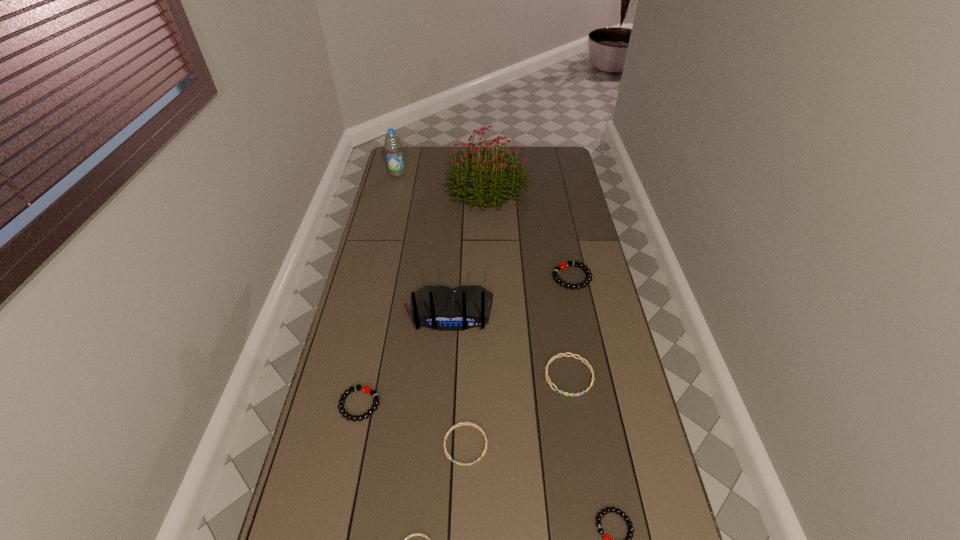
Where is `vacant space in between the fourth farthest object and the biggest black bracelet`? vacant space in between the fourth farthest object and the biggest black bracelet is located at coordinates (512, 295).

Locate an element on the screen. empty space between the third farthest object and the rightmost blue bracelet is located at coordinates (570, 326).

This screenshot has width=960, height=540. What are the coordinates of `vacant point located between the farthest black bracelet and the water bottle` in the screenshot? It's located at (x=485, y=226).

Select which object is the sixth closest to the blue water bottle. Please provide its 2D coordinates. Your answer should be formatted as a tuple, i.e. [(x, y)], where the tuple contains the x and y coordinates of a point satisfying the conditions above.

[(464, 423)]

Locate which object ranks fourth in proximity to the farthest blue bracelet. Please provide its 2D coordinates. Your answer should be formatted as a tuple, i.e. [(x, y)], where the tuple contains the x and y coordinates of a point satisfying the conditions above.

[(607, 538)]

Find the location of `the closest bracelet to the farthest bracelet`. the closest bracelet to the farthest bracelet is located at coordinates (550, 383).

Locate an element on the screen. The image size is (960, 540). the third closest bracelet to the leftmost bracelet is located at coordinates (550, 383).

You are a GUI agent. You are given a task and a screenshot of the screen. Output one action in this format:
    pyautogui.click(x=<x>, y=<y>)
    Task: Click on the closest black bracelet to the smallest black bracelet
    The image size is (960, 540).
    Given the screenshot: What is the action you would take?
    pyautogui.click(x=368, y=390)

The width and height of the screenshot is (960, 540). Find the location of `black bracelet object that ranks as the closest to the smallest blue bracelet`. black bracelet object that ranks as the closest to the smallest blue bracelet is located at coordinates (368, 390).

Identify which blue bracelet is located as the third nearest to the seventh nearest object. Please provide its 2D coordinates. Your answer should be formatted as a tuple, i.e. [(x, y)], where the tuple contains the x and y coordinates of a point satisfying the conditions above.

[(415, 534)]